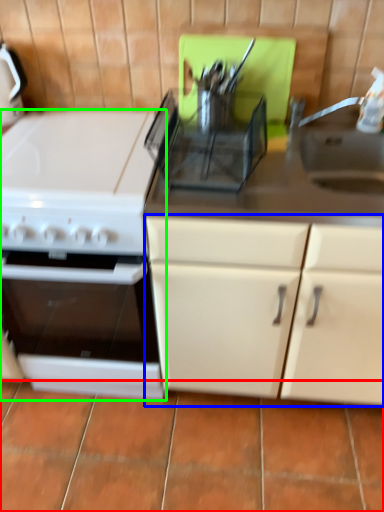
Question: Which is farther away from tile (highlighted by a red box)? cabinetry (highlighted by a blue box) or kitchen appliance (highlighted by a green box)?

Choices:
 (A) cabinetry
 (B) kitchen appliance

Answer: (B)